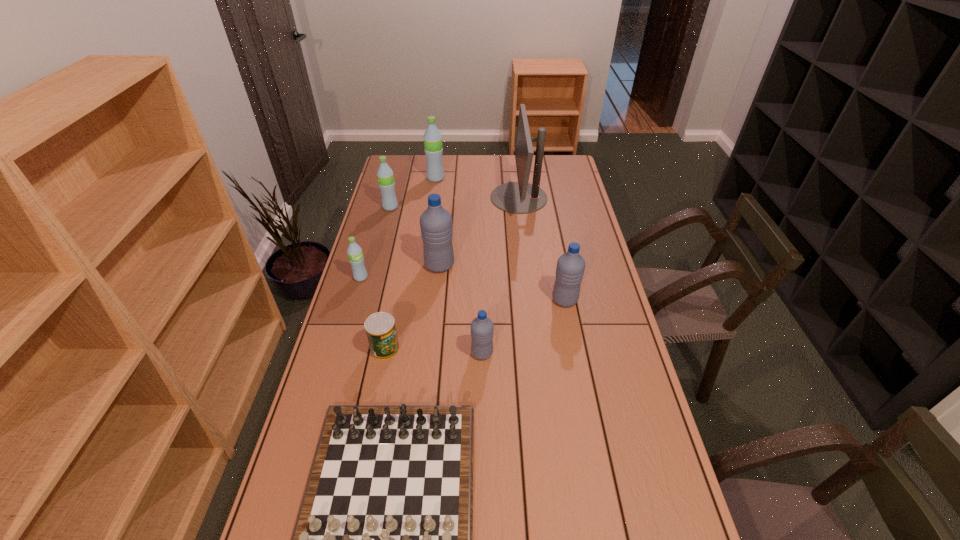
Find the location of a particular element. The image size is (960, 540). the nearest water bottle is located at coordinates (482, 328).

Locate an element on the screen. Image resolution: width=960 pixels, height=540 pixels. the nearest blue water bottle is located at coordinates (482, 328).

You are a GUI agent. You are given a task and a screenshot of the screen. Output one action in this format:
    pyautogui.click(x=<x>, y=<y>)
    Task: Click on the eighth tallest object
    This screenshot has width=960, height=540.
    Given the screenshot: What is the action you would take?
    pyautogui.click(x=380, y=328)

Where is `free space located 0.050m on the screen of the gray computer monitor`? The height and width of the screenshot is (540, 960). free space located 0.050m on the screen of the gray computer monitor is located at coordinates (x=479, y=198).

Locate an element on the screen. The image size is (960, 540). blank space located on the screen of the gray computer monitor is located at coordinates (470, 198).

Identify the location of free space located on the screen of the gray computer monitor. This screenshot has width=960, height=540. (446, 198).

Find the location of a particular element. vacant space located 0.130m on the back of the farthest green water bottle is located at coordinates (439, 161).

Locate an element on the screen. vacant space situated 0.210m on the right of the leftmost blue water bottle is located at coordinates (511, 265).

The height and width of the screenshot is (540, 960). Identify the location of free space located on the front of the fifth nearest water bottle. point(381,244).

This screenshot has height=540, width=960. In order to click on vacant space located on the right of the rightmost water bottle in this screenshot , I will do click(x=612, y=300).